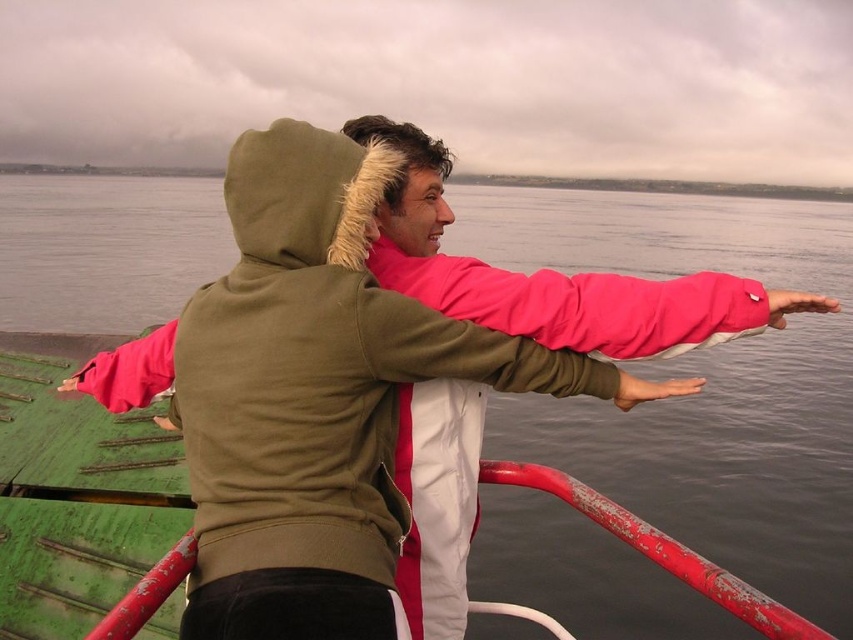
Can you confirm if pink matte jacket at center is positioned to the right of rusty metal rail at lower right?

No, pink matte jacket at center is not to the right of rusty metal rail at lower right.

Is point (193, 342) closer to camera compared to point (740, 595)?

No, it is not.

Where is `pink matte jacket at center`? The image size is (853, 640). pink matte jacket at center is located at coordinates (318, 365).

Who is higher up, green matte water at center or rusty metal rail at lower right?

Positioned higher is green matte water at center.

Based on the photo, measure the distance between green matte water at center and rusty metal rail at lower right.

green matte water at center and rusty metal rail at lower right are 34.10 meters apart.

Identify the location of green matte water at center. The width and height of the screenshot is (853, 640). (706, 372).

Locate an element on the screen. green matte water at center is located at coordinates (706, 372).

Who is lower down, green matte water at center or pink matte jacket at center?

pink matte jacket at center is below.

Does point (7, 209) come behind point (317, 273)?

That is True.

Between point (740, 200) and point (320, 314), which one is positioned behind?

The point (740, 200) is behind.

This screenshot has height=640, width=853. What are the coordinates of `green matte water at center` in the screenshot? It's located at (706, 372).